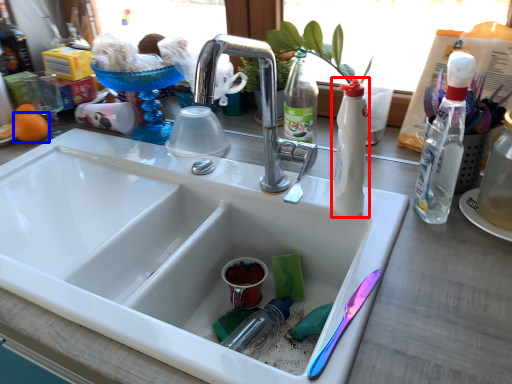
Question: Which point is closer to the camera, bottle (highlighted by a red box) or orange (highlighted by a blue box)?

Choices:
 (A) bottle
 (B) orange

Answer: (A)